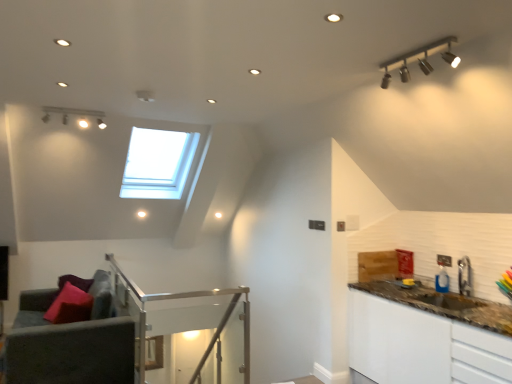
Question: Is velvet grey armchair at lower left further to camera compared to matte pink pillow at lower left?

Choices:
 (A) yes
 (B) no

Answer: (B)

Question: Considering the relative sizes of velvet grey armchair at lower left and matte pink pillow at lower left in the image provided, is velvet grey armchair at lower left taller than matte pink pillow at lower left?

Choices:
 (A) no
 (B) yes

Answer: (B)

Question: Considering the relative sizes of velvet grey armchair at lower left and matte pink pillow at lower left in the image provided, is velvet grey armchair at lower left shorter than matte pink pillow at lower left?

Choices:
 (A) no
 (B) yes

Answer: (A)

Question: Does velvet grey armchair at lower left have a smaller size compared to matte pink pillow at lower left?

Choices:
 (A) yes
 (B) no

Answer: (B)

Question: Is velvet grey armchair at lower left at the left side of matte pink pillow at lower left?

Choices:
 (A) yes
 (B) no

Answer: (A)

Question: Would you consider velvet grey armchair at lower left to be distant from matte pink pillow at lower left?

Choices:
 (A) yes
 (B) no

Answer: (B)

Question: Is matte pink pillow at lower left facing away from metallic silver faucet at right?

Choices:
 (A) no
 (B) yes

Answer: (B)

Question: Can you confirm if matte pink pillow at lower left is thinner than metallic silver faucet at right?

Choices:
 (A) yes
 (B) no

Answer: (B)

Question: From the image's perspective, is matte pink pillow at lower left on top of metallic silver faucet at right?

Choices:
 (A) no
 (B) yes

Answer: (A)

Question: Would you say matte pink pillow at lower left contains metallic silver faucet at right?

Choices:
 (A) yes
 (B) no

Answer: (B)

Question: Is the position of matte pink pillow at lower left more distant than that of metallic silver faucet at right?

Choices:
 (A) yes
 (B) no

Answer: (A)

Question: From the image's perspective, would you say matte pink pillow at lower left is shown under metallic silver faucet at right?

Choices:
 (A) no
 (B) yes

Answer: (B)

Question: From the image's perspective, is velvet grey armchair at lower left under metallic silver faucet at right?

Choices:
 (A) yes
 (B) no

Answer: (A)